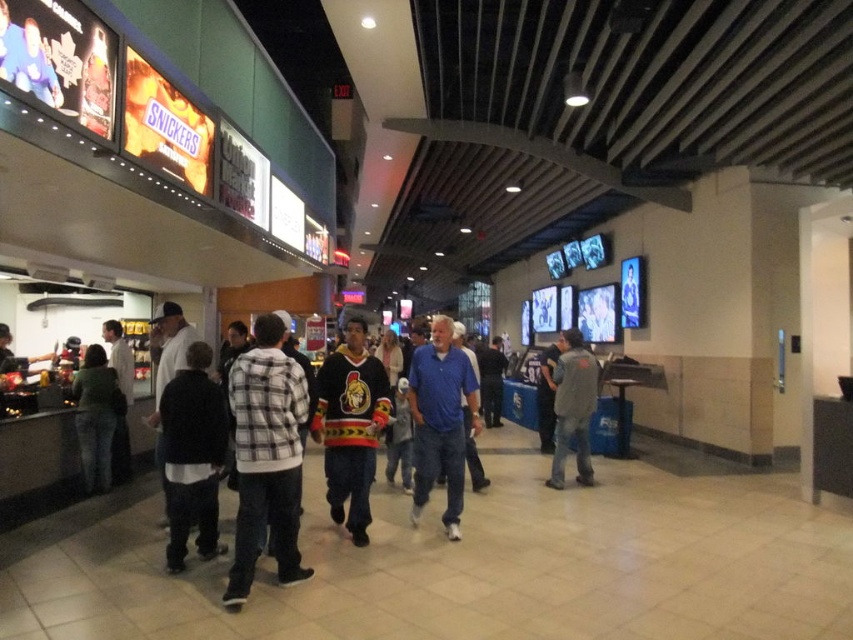
Which is behind, point (201, 433) or point (462, 452)?

The point (462, 452) is behind.

Is black fleece jacket at center further to camera compared to blue cotton shirt at center?

No, black fleece jacket at center is in front of blue cotton shirt at center.

Image resolution: width=853 pixels, height=640 pixels. Describe the element at coordinates (192, 456) in the screenshot. I see `black fleece jacket at center` at that location.

Find the location of `black fleece jacket at center`. black fleece jacket at center is located at coordinates (192, 456).

What do you see at coordinates (440, 419) in the screenshot? I see `blue cotton shirt at center` at bounding box center [440, 419].

In the scene shown: Which is more to the right, blue cotton shirt at center or green cotton hoodie at center?

blue cotton shirt at center

Is point (453, 472) positioned behind point (74, 396)?

That is False.

The height and width of the screenshot is (640, 853). I want to click on blue cotton shirt at center, so click(x=440, y=419).

Between point (297, 513) and point (457, 508), which one is positioned in front?

Point (297, 513) is in front.

Is point (242, 433) more distant than point (416, 420)?

No, (242, 433) is closer to viewer.

You are a GUI agent. You are given a task and a screenshot of the screen. Output one action in this format:
    pyautogui.click(x=<x>, y=<y>)
    Task: Click on the plaid fabric shirt at center
    This screenshot has height=640, width=853.
    Given the screenshot: What is the action you would take?
    pyautogui.click(x=265, y=456)